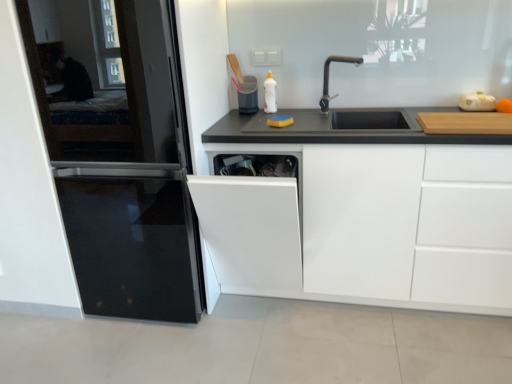
Identify the location of empty space that is ontop of wooden cutting board at right (from a real-world perspective). (475, 113).